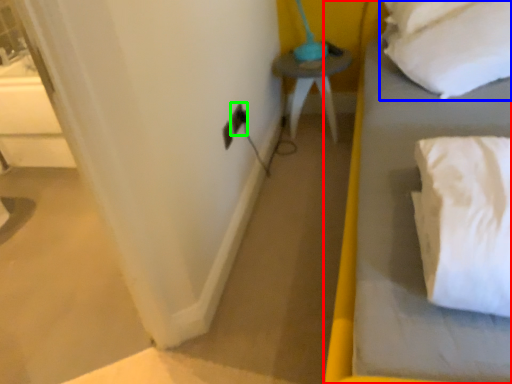
Question: Estimate the real-world distances between objects in this image. Which object is closer to bed (highlighted by a red box), pillow (highlighted by a blue box) or electric outlet (highlighted by a green box)?

Choices:
 (A) pillow
 (B) electric outlet

Answer: (A)